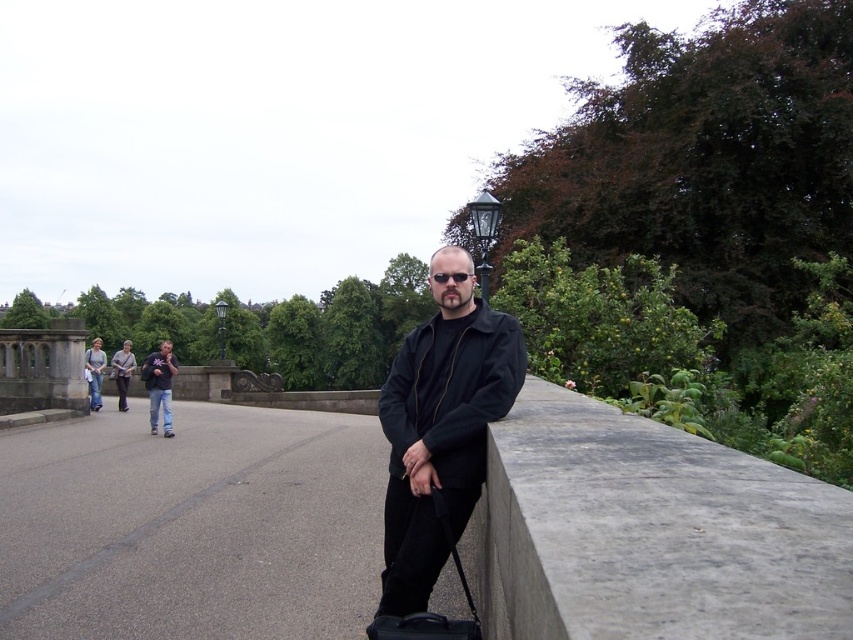
You are a painter setting up your easel. You have a canvas that is 1.2 meters wide. You want to place it along the gray concrete ledge at right so you can paint the black matte jacket at center. Will the ledge be wide enough to hold your canvas?

The gray concrete ledge at right has a width less than the black matte jacket at center. Since the canvas is 1.2 meters wide, and the ledge is narrower than the jacket, it might not be wide enough. However, without knowing the exact width of the jacket, we can only infer the ledge is insufficient.

You are a photographer trying to capture both the black matte jacket at center and the dark gray jacket at center in a single frame. Based on their positions, which jacket should you focus on first to ensure both are in the shot?

The black matte jacket at center is in front of the dark gray jacket at center, so you should focus on the dark gray jacket at center first to ensure both are in the shot.

You are a photographer trying to capture a wide shot of the scene. You notice the gray concrete ledge at right and the black matte jacket at center. Which object should you focus on to ensure it takes up more of the frame?

The black matte jacket at center should be focused on because it occupies more space in the scene than the gray concrete ledge at right.